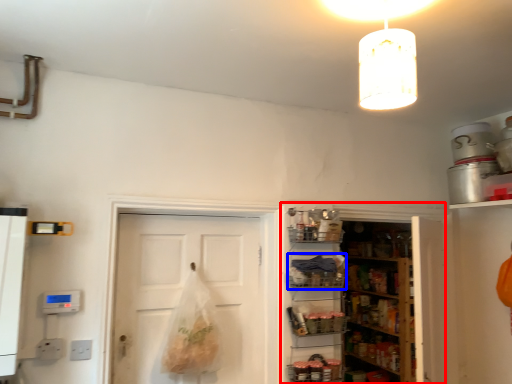
Question: Which of the following is the closest to the observer, cabinetry (highlighted by a red box) or shelf (highlighted by a blue box)?

Choices:
 (A) cabinetry
 (B) shelf

Answer: (B)